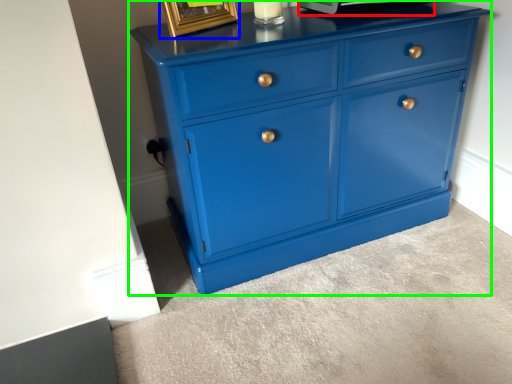
Question: Which object is positioned closest to appliance (highlighted by a red box)? Select from picture frame (highlighted by a blue box) and chest of drawers (highlighted by a green box).

Choices:
 (A) picture frame
 (B) chest of drawers

Answer: (A)